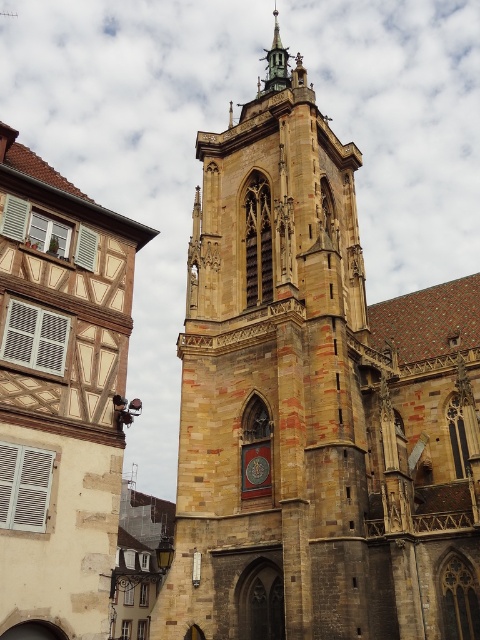
You are standing at the point marked by the coordinate point at point [60,396]. You want to take a photo of the historic church tower. Which direction should you face to capture it in your view?

You should face to the right to capture the historic church tower in your view because the wooden half timbered house at left is located to your left side, and the church tower is to your right.

What does the point at coordinates (315, 408) indicate in the image?

The point at coordinates (315, 408) marks the location of the brown stone tower at center.